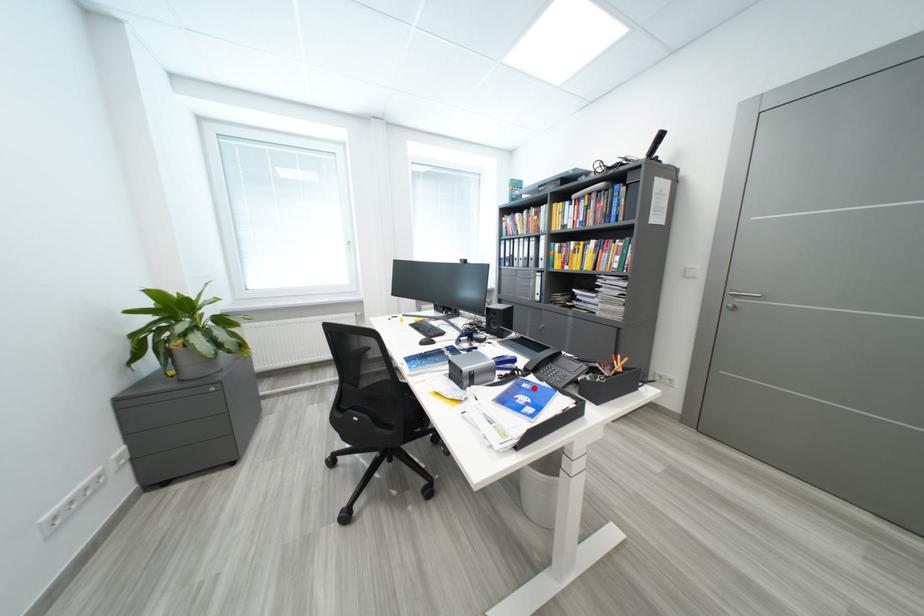
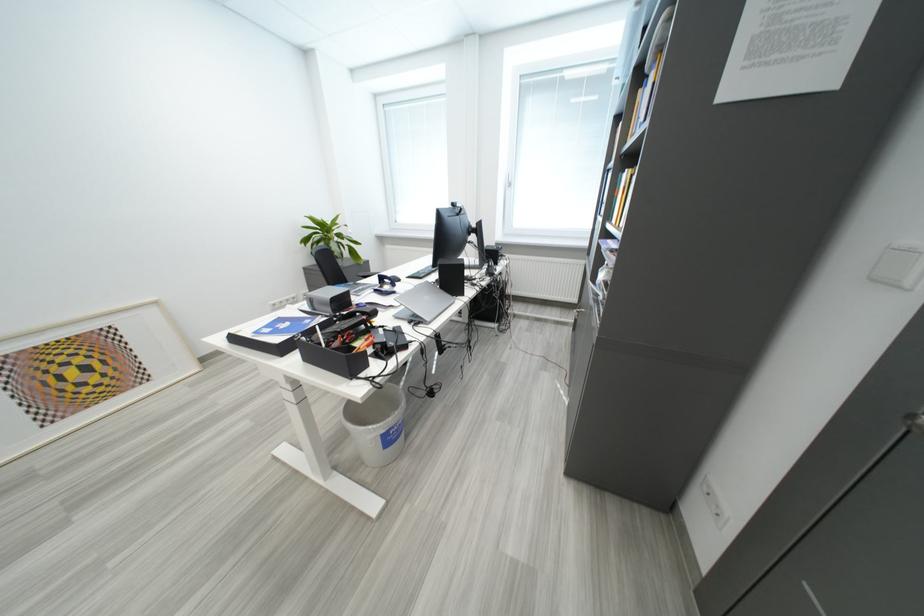
Question: I am providing you with two images of the same scene from different viewpoints. A red point is marked on the first image. At the location where the point appears in image 1, is it still visible in image 2?

Choices:
 (A) Yes
 (B) No

Answer: (A)